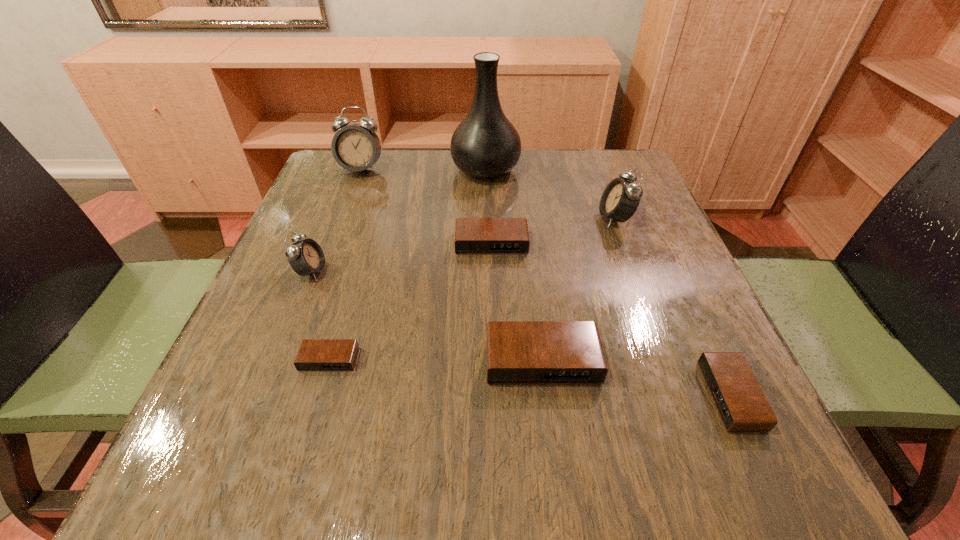
This screenshot has height=540, width=960. I want to click on vacant region located 0.140m on the face of the nearest white alarm clock, so click(397, 272).

This screenshot has width=960, height=540. I want to click on free spot located on the front face of the biggest black alarm clock, so click(x=550, y=428).

Where is `vacant space located on the front face of the third shortest alarm clock`? vacant space located on the front face of the third shortest alarm clock is located at coordinates (492, 272).

At what (x,y) coordinates should I click in order to perform the action: click on vacant space positioned 0.390m on the front face of the rightmost alarm clock. Please return your answer as a coordinate pair (x, y). Image resolution: width=960 pixels, height=540 pixels. Looking at the image, I should click on (453, 395).

This screenshot has width=960, height=540. In order to click on free location located 0.090m on the front face of the rightmost alarm clock in this screenshot , I will do `click(652, 395)`.

Find the location of a particular element. The height and width of the screenshot is (540, 960). blank area located on the front face of the rightmost alarm clock is located at coordinates (592, 395).

This screenshot has height=540, width=960. Find the location of `vacant space located 0.110m on the front face of the smallest black alarm clock`. vacant space located 0.110m on the front face of the smallest black alarm clock is located at coordinates (305, 437).

The image size is (960, 540). Identify the location of vase at the far edge. (485, 145).

Find the location of a particular element. alarm clock that is at the far edge is located at coordinates (356, 147).

In order to click on object present at the near edge in this screenshot , I will do [742, 406].